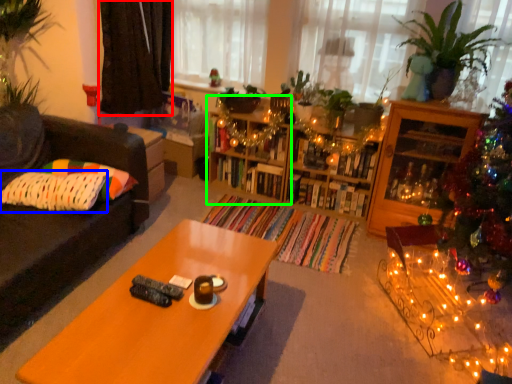
Question: Based on their relative distances, which object is nearer to curtain (highlighted by a red box)? Choose from pillow (highlighted by a blue box) and shelf (highlighted by a green box).

Choices:
 (A) pillow
 (B) shelf

Answer: (B)